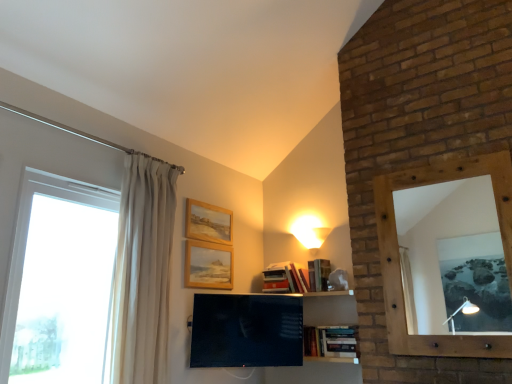
Question: Is white glass window at left at the right side of matte white lampshade at upper center?

Choices:
 (A) yes
 (B) no

Answer: (B)

Question: Is white glass window at left smaller than matte white lampshade at upper center?

Choices:
 (A) no
 (B) yes

Answer: (A)

Question: From a real-world perspective, is white glass window at left on top of matte white lampshade at upper center?

Choices:
 (A) yes
 (B) no

Answer: (B)

Question: Is white glass window at left facing towards matte white lampshade at upper center?

Choices:
 (A) yes
 (B) no

Answer: (B)

Question: Is matte white lampshade at upper center located within white glass window at left?

Choices:
 (A) yes
 (B) no

Answer: (B)

Question: Considering the relative sizes of white glass window at left and matte white lampshade at upper center in the image provided, is white glass window at left wider than matte white lampshade at upper center?

Choices:
 (A) yes
 (B) no

Answer: (B)

Question: Is wooden picture frame at upper center, arranged as the second picture frame when ordered from the bottom, oriented away from matte black tv at center?

Choices:
 (A) no
 (B) yes

Answer: (A)

Question: From the image's perspective, is wooden picture frame at upper center, which appears as the first picture frame when viewed from the top, under matte black tv at center?

Choices:
 (A) yes
 (B) no

Answer: (B)

Question: Does wooden picture frame at upper center, which appears as the first picture frame when viewed from the top, have a lesser height compared to matte black tv at center?

Choices:
 (A) yes
 (B) no

Answer: (A)

Question: Can you confirm if wooden picture frame at upper center, which appears as the first picture frame when viewed from the top, is bigger than matte black tv at center?

Choices:
 (A) yes
 (B) no

Answer: (B)

Question: Does wooden picture frame at upper center, arranged as the second picture frame when ordered from the bottom, have a smaller size compared to matte black tv at center?

Choices:
 (A) no
 (B) yes

Answer: (B)

Question: Would you say wooden picture frame at upper center, which appears as the first picture frame when viewed from the top, is outside matte black tv at center?

Choices:
 (A) no
 (B) yes

Answer: (B)

Question: Does wooden picture frame at upper center, which appears as the second picture frame when viewed from the top, touch matte black tv at center?

Choices:
 (A) no
 (B) yes

Answer: (A)